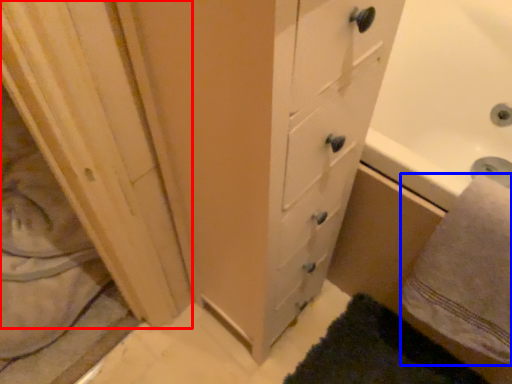
Question: Among these objects, which one is nearest to the camera, screen door (highlighted by a red box) or bath towel (highlighted by a blue box)?

Choices:
 (A) screen door
 (B) bath towel

Answer: (B)